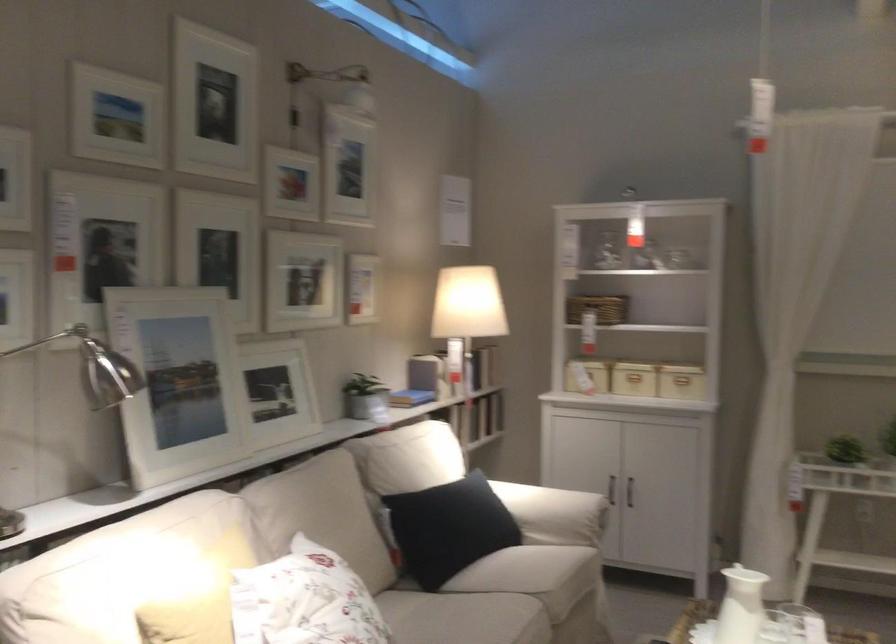
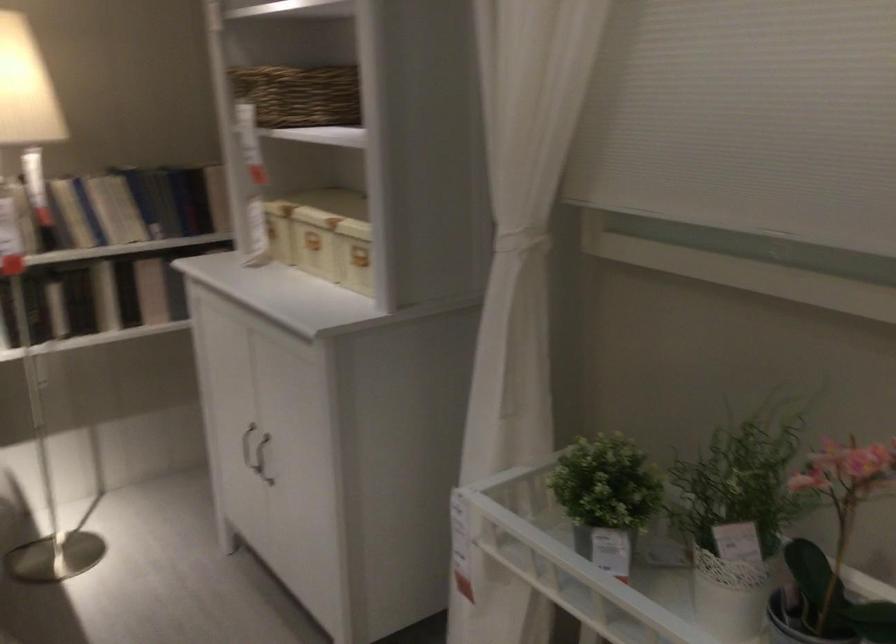
The point at [621,484] is marked in the first image. Where is the corresponding point in the second image?

(247, 446)